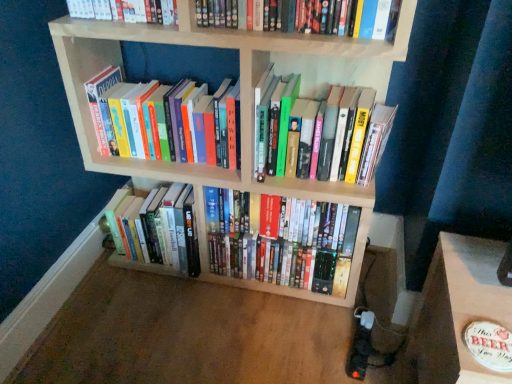
This screenshot has height=384, width=512. I want to click on hardcover books at center, which is counted as the 4th book, starting from the top, so click(x=160, y=230).

Describe the element at coordinates (241, 106) in the screenshot. The height and width of the screenshot is (384, 512). I see `light wood bookcase at center` at that location.

The height and width of the screenshot is (384, 512). What do you see at coordinates (329, 75) in the screenshot?
I see `hardcover books at center, the third book in the bottom-to-top sequence` at bounding box center [329, 75].

The image size is (512, 384). I want to click on hardcover books at center, the 2th book ordered from the bottom, so click(x=160, y=230).

Which is behind, hardcover books at left, acting as the 4th book starting from the bottom, or hardcover book at upper center, the first book when ordered from top to bottom?

hardcover books at left, acting as the 4th book starting from the bottom, is behind.

Is hardcover books at left, the 2th book when ordered from top to bottom, not near hardcover book at upper center, the first book when ordered from top to bottom?

No, hardcover books at left, the 2th book when ordered from top to bottom, is not far away from hardcover book at upper center, the first book when ordered from top to bottom.

From the image's perspective, relative to hardcover book at upper center, the first book when ordered from top to bottom, is hardcover books at left, acting as the 4th book starting from the bottom, above or below?

Based on their image positions, hardcover books at left, acting as the 4th book starting from the bottom, is located beneath hardcover book at upper center, the first book when ordered from top to bottom.

Is point (127, 130) less distant than point (282, 70)?

No, (127, 130) is further to viewer.

Looking at this image, considering the sizes of hardcover books at left, acting as the 4th book starting from the bottom, and hardcover books at center, the 3th book from the top, in the image, is hardcover books at left, acting as the 4th book starting from the bottom, wider or thinner than hardcover books at center, the 3th book from the top,?

hardcover books at left, acting as the 4th book starting from the bottom, is thinner than hardcover books at center, the 3th book from the top.

Where is `the 1st book below the hardcover books at center, the 3th book from the top (from a real-world perspective)`? the 1st book below the hardcover books at center, the 3th book from the top (from a real-world perspective) is located at coordinates (181, 124).

Would you say hardcover books at left, acting as the 4th book starting from the bottom, is outside hardcover books at center, the 3th book from the top?

Yes, hardcover books at left, acting as the 4th book starting from the bottom, is not within hardcover books at center, the 3th book from the top.

From the image's perspective, which object appears higher, hardcover books at left, acting as the 4th book starting from the bottom, or light wood bookcase at center?

hardcover books at left, acting as the 4th book starting from the bottom, appears higher in the image.

Locate an element on the screen. bookcase that is in front of the hardcover books at left, the 2th book when ordered from top to bottom is located at coordinates (241, 106).

Considering the sizes of hardcover books at left, acting as the 4th book starting from the bottom, and light wood bookcase at center in the image, is hardcover books at left, acting as the 4th book starting from the bottom, taller or shorter than light wood bookcase at center?

Clearly, hardcover books at left, acting as the 4th book starting from the bottom, is shorter compared to light wood bookcase at center.

Can you confirm if hardcover books at left, the 2th book when ordered from top to bottom, is smaller than light wood bookcase at center?

Indeed, hardcover books at left, the 2th book when ordered from top to bottom, has a smaller size compared to light wood bookcase at center.

Is hardcover books at center, the 2th book ordered from the bottom, bigger than light wood bookcase at center?

Incorrect, hardcover books at center, the 2th book ordered from the bottom, is not larger than light wood bookcase at center.

Does point (123, 215) come behind point (81, 152)?

Yes, it is behind point (81, 152).

Are hardcover books at center, which is counted as the 4th book, starting from the top, and light wood bookcase at center making contact?

No, hardcover books at center, which is counted as the 4th book, starting from the top, is not with light wood bookcase at center.

Is light wood bookcase at center at the back of hardcover books at center, the 3th book from the top?

Yes, hardcover books at center, the 3th book from the top,'s orientation is away from light wood bookcase at center.

Find the location of a particular element. book that is the 2nd object above the light wood bookcase at center (from a real-world perspective) is located at coordinates (329, 75).

Considering the positions of objects hardcover books at center, the 3th book from the top, and light wood bookcase at center in the image provided, who is more to the left, hardcover books at center, the 3th book from the top, or light wood bookcase at center?

light wood bookcase at center.

Between hardcover books at center, the 3th book from the top, and light wood bookcase at center, which one has more height?

Standing taller between the two is light wood bookcase at center.

Which is correct: hardcover books at center, the 2th book ordered from the bottom, is inside hardcover book at upper center, the first book when ordered from top to bottom, or outside of it?

hardcover books at center, the 2th book ordered from the bottom, is located beyond the bounds of hardcover book at upper center, the first book when ordered from top to bottom.

Is hardcover books at center, the 2th book ordered from the bottom, closer to the viewer compared to hardcover book at upper center, the first book when ordered from top to bottom?

No, it is not.

From the image's perspective, which is above, hardcover books at center, which is counted as the 4th book, starting from the top, or hardcover book at upper center, placed as the 5th book when sorted from bottom to top?

hardcover book at upper center, placed as the 5th book when sorted from bottom to top, from the image's perspective.

Would you say hardcover books at center, the 2th book ordered from the bottom, is to the left or to the right of hardcover book at upper center, the first book when ordered from top to bottom, in the picture?

Clearly, hardcover books at center, the 2th book ordered from the bottom, is on the left of hardcover book at upper center, the first book when ordered from top to bottom, in the image.

Which of these two, shiny plastic dvds at center, the 1th book positioned from the bottom, or hardcover books at center, the third book in the bottom-to-top sequence, is wider?

hardcover books at center, the third book in the bottom-to-top sequence.

From a real-world perspective, relative to hardcover books at center, the third book in the bottom-to-top sequence, is shiny plastic dvds at center, the 1th book positioned from the bottom, vertically above or below?

Clearly, from a real-world perspective, shiny plastic dvds at center, the 1th book positioned from the bottom, is below hardcover books at center, the third book in the bottom-to-top sequence.

Does shiny plastic dvds at center, placed as the 5th book when sorted from top to bottom, come behind hardcover books at center, the 3th book from the top?

That is True.

Is shiny plastic dvds at center, placed as the 5th book when sorted from top to bottom, oriented away from hardcover books at center, the third book in the bottom-to-top sequence?

shiny plastic dvds at center, placed as the 5th book when sorted from top to bottom, does not have its back to hardcover books at center, the third book in the bottom-to-top sequence.

Locate an element on the screen. The height and width of the screenshot is (384, 512). the 2nd book positioned above the hardcover books at left, the 2th book when ordered from top to bottom (from a real-world perspective) is located at coordinates (126, 10).

Locate an element on the screen. The width and height of the screenshot is (512, 384). the 2nd book to the right of the hardcover books at left, acting as the 4th book starting from the bottom, starting your count from the anchor is located at coordinates (329, 75).

Estimate the real-world distances between objects in this image. Which object is further from light wood bookcase at center, shiny plastic dvds at center, placed as the 5th book when sorted from top to bottom, or hardcover book at upper center, the first book when ordered from top to bottom?

Based on the image, hardcover book at upper center, the first book when ordered from top to bottom, appears to be further to light wood bookcase at center.

When comparing their distances from hardcover book at upper center, the first book when ordered from top to bottom, does hardcover books at center, the third book in the bottom-to-top sequence, or light wood bookcase at center seem closer?

Based on the image, light wood bookcase at center appears to be nearer to hardcover book at upper center, the first book when ordered from top to bottom.

Looking at the image, which one is located closer to hardcover books at center, the 2th book ordered from the bottom, shiny plastic dvds at center, the 1th book positioned from the bottom, or hardcover books at center, the third book in the bottom-to-top sequence?

Among the two, shiny plastic dvds at center, the 1th book positioned from the bottom, is located nearer to hardcover books at center, the 2th book ordered from the bottom.

Which object lies further to the anchor point hardcover books at left, the 2th book when ordered from top to bottom, hardcover books at center, the 3th book from the top, or shiny plastic dvds at center, the 1th book positioned from the bottom?

shiny plastic dvds at center, the 1th book positioned from the bottom, is further to hardcover books at left, the 2th book when ordered from top to bottom.

Looking at the image, which one is located closer to shiny plastic dvds at center, the 1th book positioned from the bottom, hardcover books at left, acting as the 4th book starting from the bottom, or light wood bookcase at center?

light wood bookcase at center lies closer to shiny plastic dvds at center, the 1th book positioned from the bottom, than the other object.

Which object lies nearer to the anchor point hardcover books at left, the 2th book when ordered from top to bottom, hardcover books at center, the 2th book ordered from the bottom, or hardcover books at center, the 3th book from the top?

hardcover books at center, the 2th book ordered from the bottom.

Consider the image. Looking at the image, which one is located closer to hardcover books at center, the 2th book ordered from the bottom, hardcover books at left, the 2th book when ordered from top to bottom, or shiny plastic dvds at center, the 1th book positioned from the bottom?

shiny plastic dvds at center, the 1th book positioned from the bottom, is closer to hardcover books at center, the 2th book ordered from the bottom.

From the image, which object appears to be nearer to shiny plastic dvds at center, the 1th book positioned from the bottom, hardcover books at left, acting as the 4th book starting from the bottom, or hardcover books at center, the 2th book ordered from the bottom?

The object closer to shiny plastic dvds at center, the 1th book positioned from the bottom, is hardcover books at center, the 2th book ordered from the bottom.

Identify the location of bookcase between hardcover book at upper center, the first book when ordered from top to bottom, and shiny plastic dvds at center, the 1th book positioned from the bottom, in the vertical direction. Image resolution: width=512 pixels, height=384 pixels. (241, 106).

This screenshot has width=512, height=384. I want to click on book between hardcover books at left, acting as the 4th book starting from the bottom, and hardcover books at center, the third book in the bottom-to-top sequence, so click(x=285, y=243).

You are a GUI agent. You are given a task and a screenshot of the screen. Output one action in this format:
    pyautogui.click(x=<x>, y=<y>)
    Task: Click on the bookcase between hardcover books at center, the 2th book ordered from the bottom, and hardcover books at center, the third book in the bottom-to-top sequence, in the horizontal direction
    
    Given the screenshot: What is the action you would take?
    pyautogui.click(x=241, y=106)

Where is `bookcase situated between hardcover book at upper center, placed as the 5th book when sorted from bottom to top, and hardcover books at center, the third book in the bottom-to-top sequence, from left to right`? bookcase situated between hardcover book at upper center, placed as the 5th book when sorted from bottom to top, and hardcover books at center, the third book in the bottom-to-top sequence, from left to right is located at coordinates (241, 106).